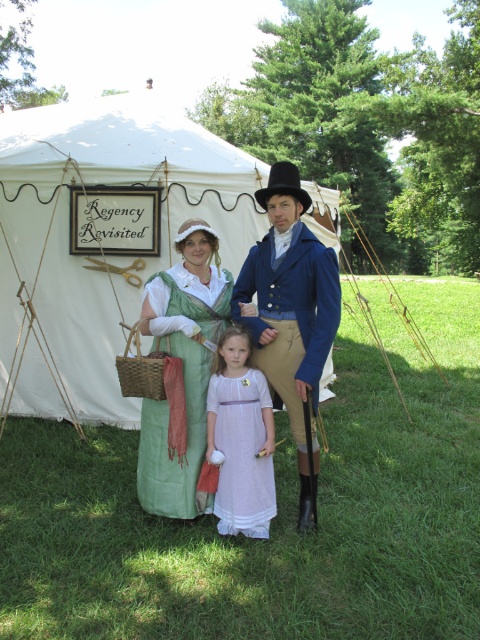
Question: Considering the relative positions of white canvas tent at center and black felt top hat at upper center in the image provided, where is white canvas tent at center located with respect to black felt top hat at upper center?

Choices:
 (A) below
 (B) above

Answer: (A)

Question: Which is nearer to the light purple cotton dress at center?

Choices:
 (A) green satin dress at center
 (B) blue wool coat at center
 (C) black felt top hat at upper center
 (D) white canvas tent at center

Answer: (A)

Question: Among these objects, which one is nearest to the camera?

Choices:
 (A) black felt top hat at upper center
 (B) light purple cotton dress at center
 (C) blue wool coat at center

Answer: (C)

Question: Can you confirm if white canvas tent at center is positioned above green satin dress at center?

Choices:
 (A) no
 (B) yes

Answer: (B)

Question: Which point is closer to the camera?

Choices:
 (A) blue wool coat at center
 (B) green satin dress at center

Answer: (A)

Question: Does blue wool coat at center appear over green satin dress at center?

Choices:
 (A) no
 (B) yes

Answer: (B)